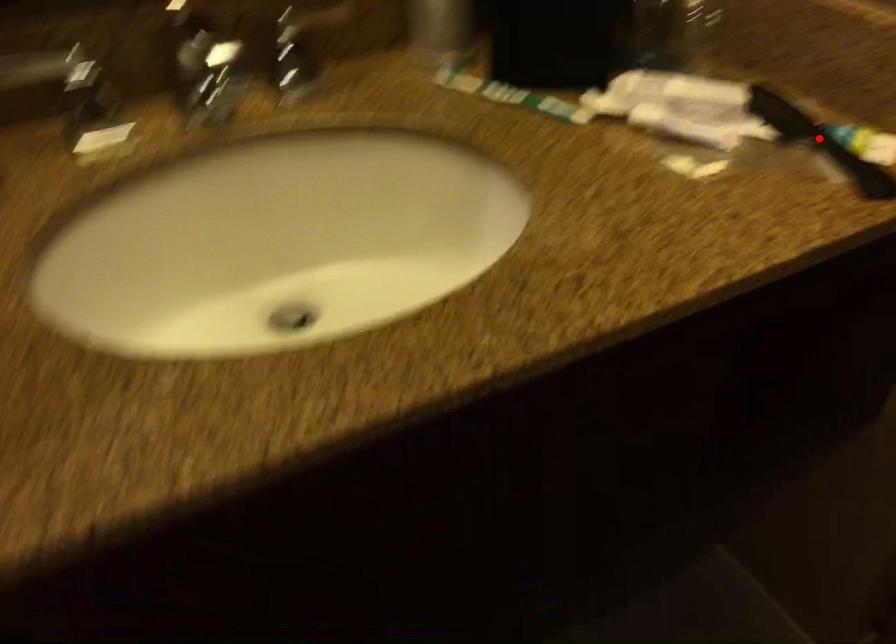
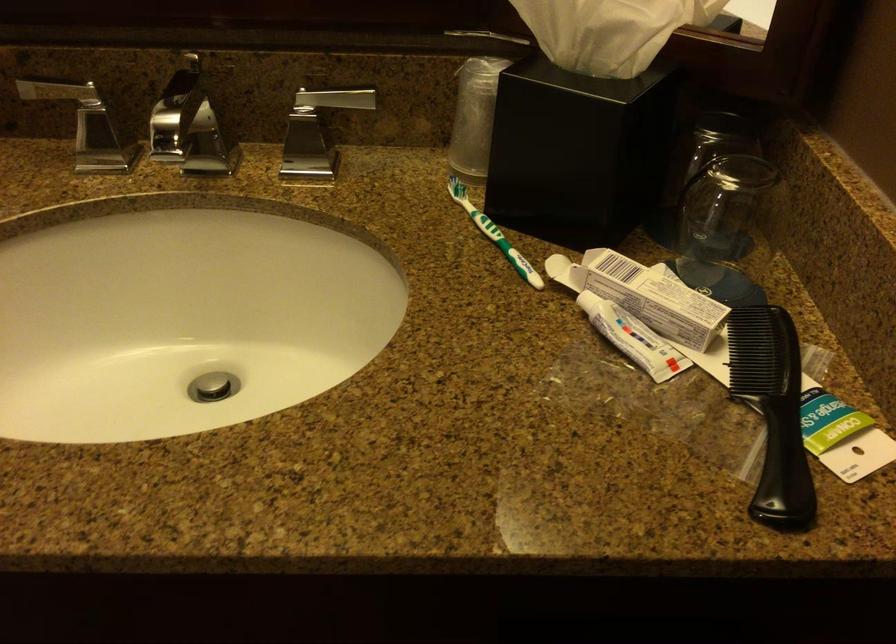
Question: I am providing you with two images of the same scene from different viewpoints. In image1, a red point is highlighted. Considering the same 3D point in image2, which of the following is correct?

Choices:
 (A) It is closer
 (B) It is farther

Answer: (A)